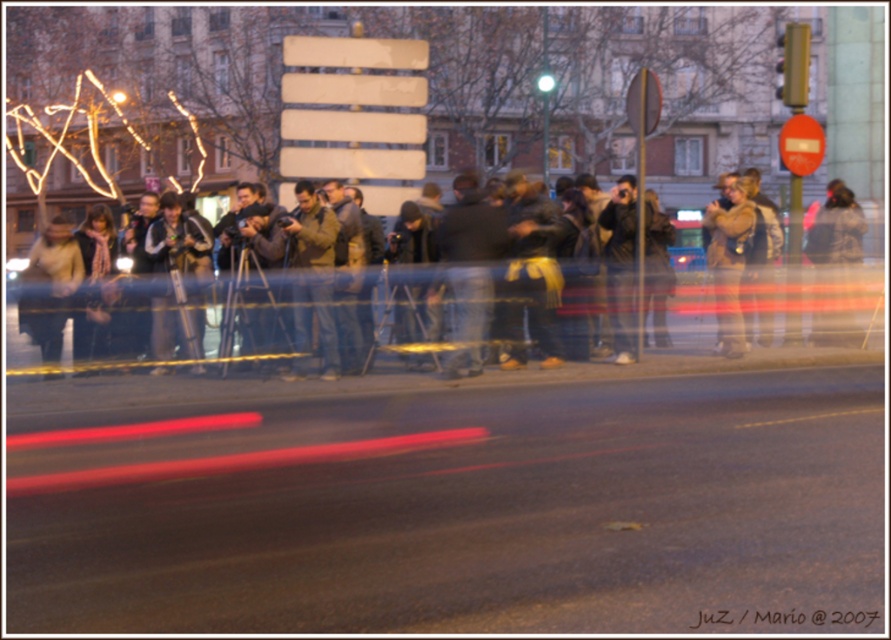
Can you confirm if dark brown jacket at center is positioned to the left of brown leather jacket at right?

In fact, dark brown jacket at center is to the right of brown leather jacket at right.

Between dark brown jacket at center and brown leather jacket at right, which one is positioned higher?

dark brown jacket at center is higher up.

The image size is (891, 640). Identify the location of dark brown jacket at center. (532, 296).